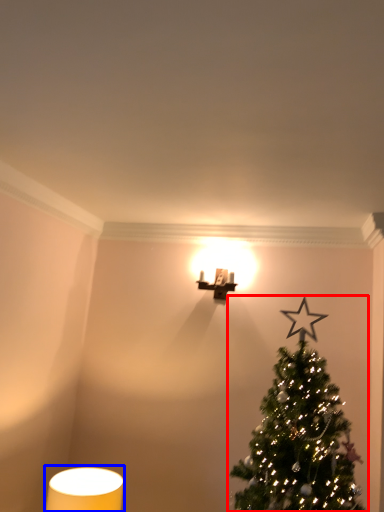
Question: Which point is closer to the camera, christmas tree (highlighted by a red box) or table lamp (highlighted by a blue box)?

Choices:
 (A) christmas tree
 (B) table lamp

Answer: (A)